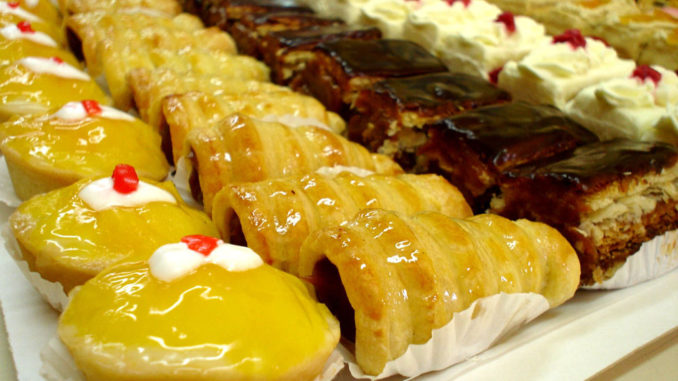
The height and width of the screenshot is (381, 678). What are the coordinates of `white tray` in the screenshot? It's located at (605, 342).